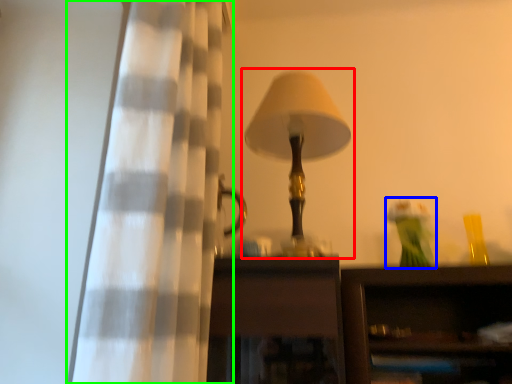
Question: Estimate the real-world distances between objects in this image. Which object is closer to lamp (highlighted by a red box), toy (highlighted by a blue box) or curtain (highlighted by a green box)?

Choices:
 (A) toy
 (B) curtain

Answer: (B)